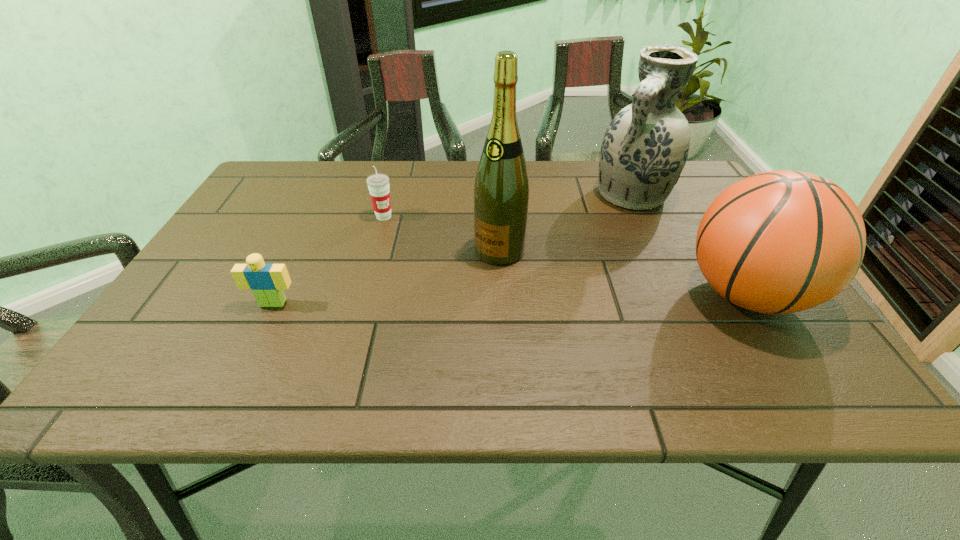
Image resolution: width=960 pixels, height=540 pixels. Identify the location of basketball at the right edge. (778, 242).

Find the location of a particular element. vase that is at the right edge is located at coordinates (645, 147).

The width and height of the screenshot is (960, 540). I want to click on object present at the far right corner, so click(x=645, y=147).

The width and height of the screenshot is (960, 540). In order to click on object at the near right corner in this screenshot , I will do `click(778, 242)`.

Where is `vacant space at the far edge of the desktop`? vacant space at the far edge of the desktop is located at coordinates (334, 161).

The height and width of the screenshot is (540, 960). I want to click on vacant region at the near edge, so click(x=624, y=353).

You are a GUI agent. You are given a task and a screenshot of the screen. Output one action in this format:
    pyautogui.click(x=<x>, y=<y>)
    Task: Click on the vacant region at the left edge of the desktop
    This screenshot has width=960, height=540.
    Given the screenshot: What is the action you would take?
    pyautogui.click(x=203, y=269)

Locate an element on the screen. vacant area at the far left corner is located at coordinates (271, 198).

Find the location of a particular element. This screenshot has width=960, height=540. free spot at the far right corner of the desktop is located at coordinates (684, 195).

Locate an element on the screen. The width and height of the screenshot is (960, 540). vacant area between the vase and the basketball is located at coordinates (689, 245).